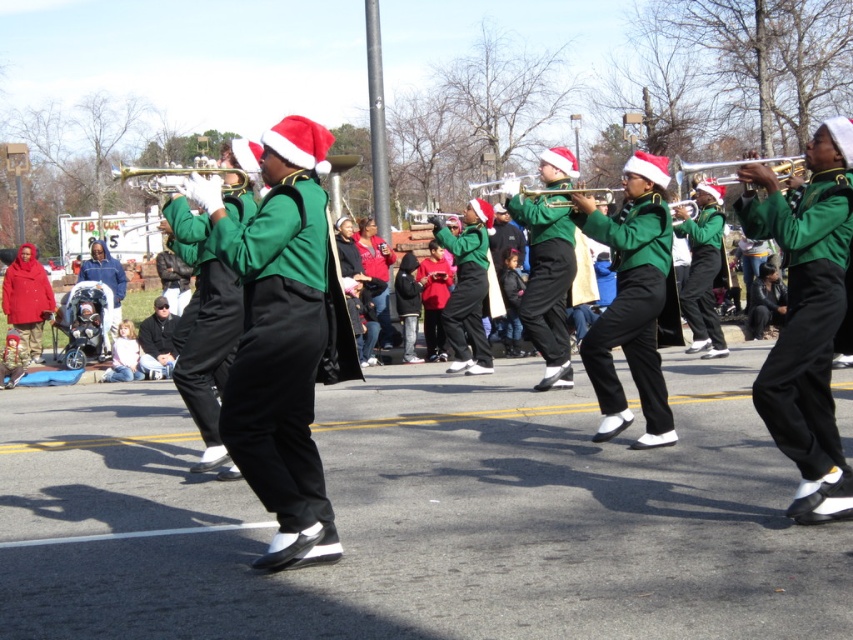
Does matte red coat at left appear under matte green trumpet at center?

Yes.

Does matte red coat at left come in front of matte green trumpet at center?

No.

The width and height of the screenshot is (853, 640). What do you see at coordinates (26, 300) in the screenshot?
I see `matte red coat at left` at bounding box center [26, 300].

Find the location of a particular element. The height and width of the screenshot is (640, 853). matte red coat at left is located at coordinates (26, 300).

Does matte red coat at left lie behind brass trumpet at center?

Yes, matte red coat at left is further from the viewer.

Based on the photo, which is more to the left, matte red coat at left or brass trumpet at center?

matte red coat at left is more to the left.

Which is in front, point (48, 292) or point (766, 157)?

Point (48, 292)

The image size is (853, 640). I want to click on matte red coat at left, so 26,300.

Is gold metallic trumpet at center positioned at the back of matte green trumpet at center?

No.

Is gold metallic trumpet at center closer to camera compared to matte green trumpet at center?

That is True.

This screenshot has width=853, height=640. What do you see at coordinates (567, 195) in the screenshot? I see `gold metallic trumpet at center` at bounding box center [567, 195].

This screenshot has width=853, height=640. What are the coordinates of `gold metallic trumpet at center` in the screenshot? It's located at (567, 195).